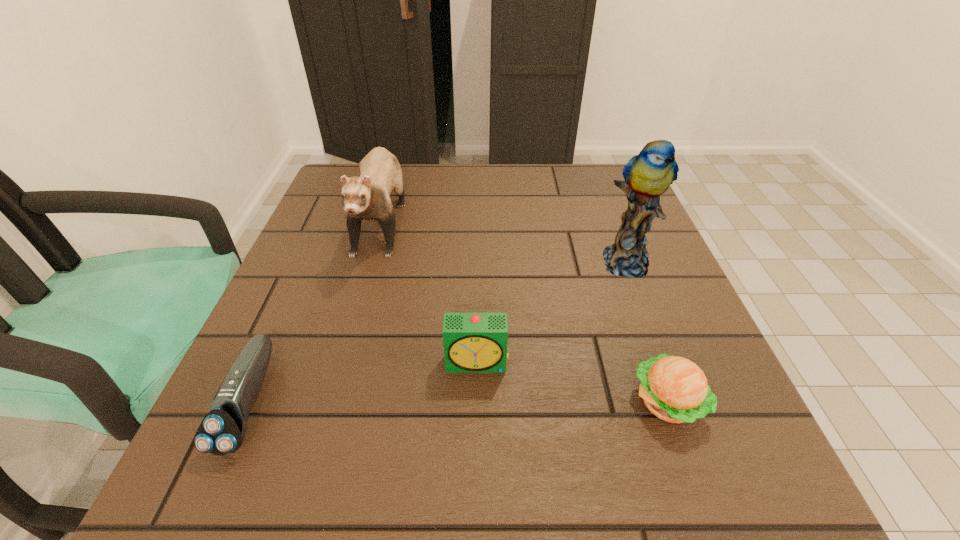
This screenshot has height=540, width=960. I want to click on the tallest object, so click(x=647, y=175).

What are the coordinates of `the fourth object from right to left` in the screenshot? It's located at (367, 197).

At what (x,y) coordinates should I click in order to perform the action: click on the second tallest object. Please return your answer as a coordinate pair (x, y). The image size is (960, 540). Looking at the image, I should click on (367, 197).

At what (x,y) coordinates should I click in order to perform the action: click on the third tallest object. Please return your answer as a coordinate pair (x, y). This screenshot has width=960, height=540. Looking at the image, I should click on (473, 342).

You are a GUI agent. You are given a task and a screenshot of the screen. Output one action in this format:
    pyautogui.click(x=<x>, y=<y>)
    Task: Click on the alarm clock
    The height and width of the screenshot is (540, 960).
    Given the screenshot: What is the action you would take?
    pyautogui.click(x=473, y=342)

Find the location of a particular element. Image resolution: width=960 pixels, height=540 pixels. the fourth tallest object is located at coordinates (674, 389).

At what (x,y) coordinates should I click in order to perform the action: click on the shortest object. Please return your answer as a coordinate pair (x, y). Looking at the image, I should click on (222, 430).

Find the location of a particular element. This screenshot has width=960, height=540. electric shaver is located at coordinates click(222, 430).

Where is `vacant space located 0.120m on the face of the tallest object`? vacant space located 0.120m on the face of the tallest object is located at coordinates (652, 332).

The image size is (960, 540). I want to click on vacant region located on the face of the ferret, so click(348, 336).